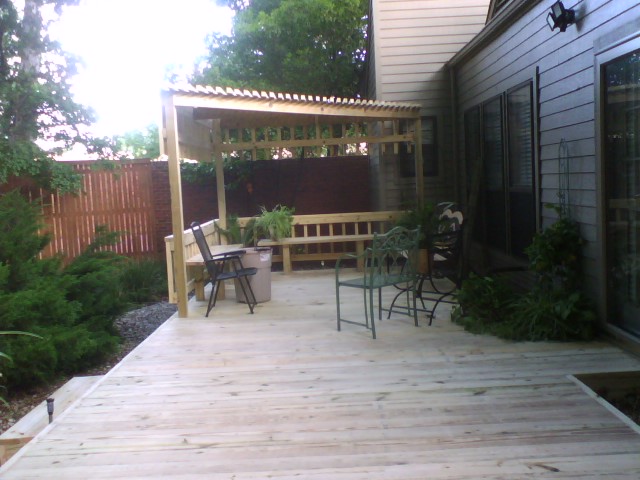
Find the location of a particular element. tan trash bin is located at coordinates pyautogui.click(x=252, y=257).